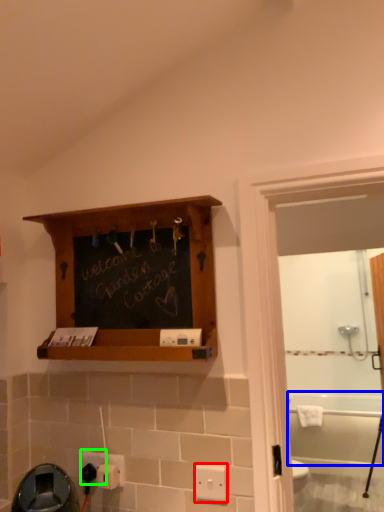
Question: Considering the real-world distances, which object is closest to light switch (highlighted by a red box)? bath (highlighted by a blue box) or electric outlet (highlighted by a green box).

Choices:
 (A) bath
 (B) electric outlet

Answer: (B)